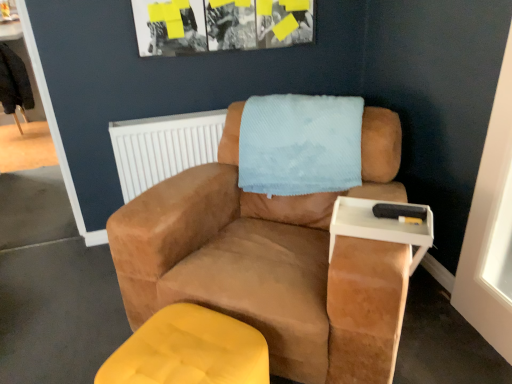
Where is `free spot above matte yellow ottoman at lower left (from a real-world perspective)`? free spot above matte yellow ottoman at lower left (from a real-world perspective) is located at coordinates (186, 349).